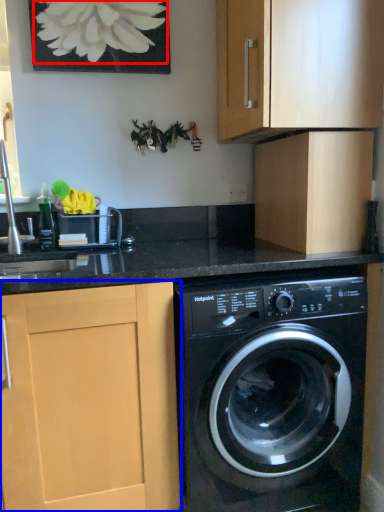
Question: Which object is further to the camera taking this photo, flower (highlighted by a red box) or cabinetry (highlighted by a blue box)?

Choices:
 (A) flower
 (B) cabinetry

Answer: (A)